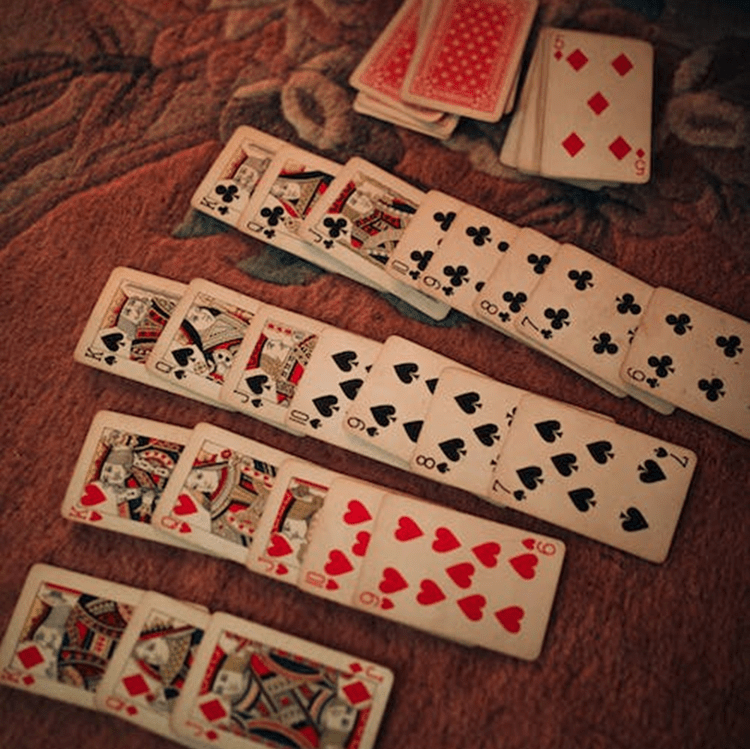
The image size is (750, 749). What are the coordinates of `rug` in the screenshot? It's located at (46, 327).